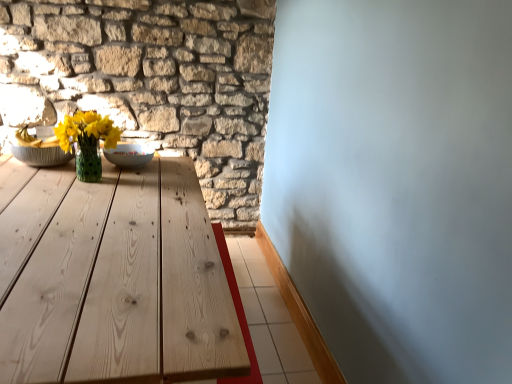
Question: Is white glossy bowl at center to the right of matte green vase at center-left from the viewer's perspective?

Choices:
 (A) no
 (B) yes

Answer: (B)

Question: Is white glossy bowl at center outside matte green vase at center-left?

Choices:
 (A) yes
 (B) no

Answer: (A)

Question: Is white glossy bowl at center surrounding matte green vase at center-left?

Choices:
 (A) yes
 (B) no

Answer: (B)

Question: Could you tell me if white glossy bowl at center is turned towards matte green vase at center-left?

Choices:
 (A) yes
 (B) no

Answer: (B)

Question: From the image's perspective, is white glossy bowl at center located beneath matte green vase at center-left?

Choices:
 (A) yes
 (B) no

Answer: (A)

Question: Is matte green vase at center-left situated inside white glossy bowl at center or outside?

Choices:
 (A) outside
 (B) inside

Answer: (A)

Question: Visually, is matte green vase at center-left positioned to the left or to the right of white glossy bowl at center?

Choices:
 (A) right
 (B) left

Answer: (B)

Question: Considering their positions, is matte green vase at center-left located in front of or behind white glossy bowl at center?

Choices:
 (A) front
 (B) behind

Answer: (A)

Question: Looking at their shapes, would you say matte green vase at center-left is wider or thinner than white glossy bowl at center?

Choices:
 (A) wide
 (B) thin

Answer: (B)

Question: Is point (88, 115) positioned closer to the camera than point (69, 49)?

Choices:
 (A) closer
 (B) farther

Answer: (A)

Question: Looking at their shapes, would you say matte green vase at center-left is wider or thinner than natural stone wall at upper left?

Choices:
 (A) wide
 (B) thin

Answer: (A)

Question: Do you think matte green vase at center-left is within natural stone wall at upper left, or outside of it?

Choices:
 (A) inside
 (B) outside

Answer: (B)

Question: From their relative heights in the image, would you say matte green vase at center-left is taller or shorter than natural stone wall at upper left?

Choices:
 (A) short
 (B) tall

Answer: (A)

Question: Is point (158, 11) closer or farther from the camera than point (138, 145)?

Choices:
 (A) closer
 (B) farther

Answer: (B)

Question: Based on their positions, is natural stone wall at upper left located to the left or right of white glossy bowl at center?

Choices:
 (A) left
 (B) right

Answer: (A)